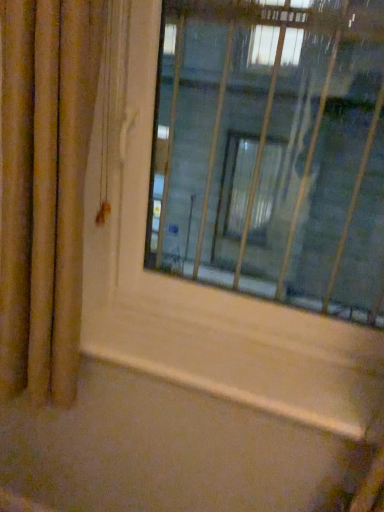
Question: Is point (157, 364) closer or farther from the camera than point (377, 249)?

Choices:
 (A) closer
 (B) farther

Answer: (A)

Question: Considering the positions of wooden at lower center and transparent glass window at center in the image, is wooden at lower center wider or thinner than transparent glass window at center?

Choices:
 (A) thin
 (B) wide

Answer: (B)

Question: Estimate the real-world distances between objects in this image. Which object is farther from the gold textured curtain at left?

Choices:
 (A) transparent glass window at center
 (B) wooden at lower center

Answer: (A)

Question: Estimate the real-world distances between objects in this image. Which object is closer to the wooden at lower center?

Choices:
 (A) gold textured curtain at left
 (B) transparent glass window at center

Answer: (A)